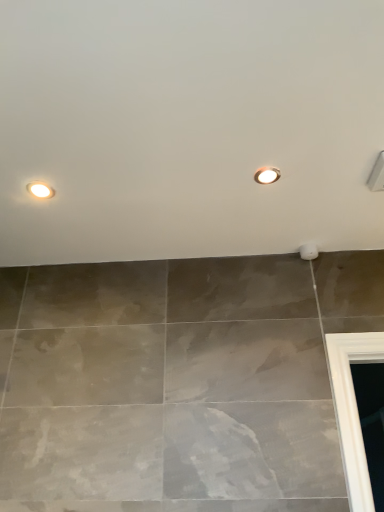
Question: From a real-world perspective, is matte white droplight at upper center, which appears as the second droplight when ordered from the bottom, physically above matte white droplight at upper left, the second droplight in the top-to-bottom sequence?

Choices:
 (A) no
 (B) yes

Answer: (B)

Question: Can you confirm if matte white droplight at upper center, the 1th droplight when ordered from top to bottom, is positioned to the left of matte white droplight at upper left, the 1th droplight in the left-to-right sequence?

Choices:
 (A) yes
 (B) no

Answer: (B)

Question: Is matte white droplight at upper center, the 1th droplight when ordered from top to bottom, in front of matte white droplight at upper left, the second droplight in the top-to-bottom sequence?

Choices:
 (A) yes
 (B) no

Answer: (A)

Question: Is matte white droplight at upper center, acting as the 1th droplight starting from the right, turned away from matte white droplight at upper left, the second droplight in the top-to-bottom sequence?

Choices:
 (A) yes
 (B) no

Answer: (B)

Question: From the image's perspective, does matte white droplight at upper center, acting as the second droplight starting from the left, appear lower than matte white droplight at upper left, which is the first droplight in bottom-to-top order?

Choices:
 (A) yes
 (B) no

Answer: (B)

Question: Considering the relative sizes of matte white droplight at upper center, the 1th droplight when ordered from top to bottom, and matte white droplight at upper left, the 1th droplight in the left-to-right sequence, in the image provided, is matte white droplight at upper center, the 1th droplight when ordered from top to bottom, taller than matte white droplight at upper left, the 1th droplight in the left-to-right sequence,?

Choices:
 (A) yes
 (B) no

Answer: (B)

Question: Can we say matte white droplight at upper left, which is the first droplight in bottom-to-top order, lies outside matte white droplight at upper center, which appears as the second droplight when ordered from the bottom?

Choices:
 (A) no
 (B) yes

Answer: (B)

Question: Are matte white droplight at upper left, the 2th droplight positioned from the right, and matte white droplight at upper center, which appears as the second droplight when ordered from the bottom, far apart?

Choices:
 (A) yes
 (B) no

Answer: (B)

Question: Does matte white droplight at upper left, the 2th droplight positioned from the right, come behind matte white droplight at upper center, acting as the second droplight starting from the left?

Choices:
 (A) no
 (B) yes

Answer: (B)

Question: Considering the relative sizes of matte white droplight at upper left, the 1th droplight in the left-to-right sequence, and matte white droplight at upper center, acting as the second droplight starting from the left, in the image provided, is matte white droplight at upper left, the 1th droplight in the left-to-right sequence, bigger than matte white droplight at upper center, acting as the second droplight starting from the left,?

Choices:
 (A) no
 (B) yes

Answer: (B)

Question: Is matte white droplight at upper left, which is the first droplight in bottom-to-top order, oriented away from matte white droplight at upper center, acting as the 1th droplight starting from the right?

Choices:
 (A) yes
 (B) no

Answer: (B)

Question: From a real-world perspective, is matte white droplight at upper left, the 1th droplight in the left-to-right sequence, physically below matte white droplight at upper center, which appears as the second droplight when ordered from the bottom?

Choices:
 (A) no
 (B) yes

Answer: (B)

Question: Based on their positions, is matte white droplight at upper center, which appears as the second droplight when ordered from the bottom, located to the left or right of matte white droplight at upper left, the 2th droplight positioned from the right?

Choices:
 (A) left
 (B) right

Answer: (B)